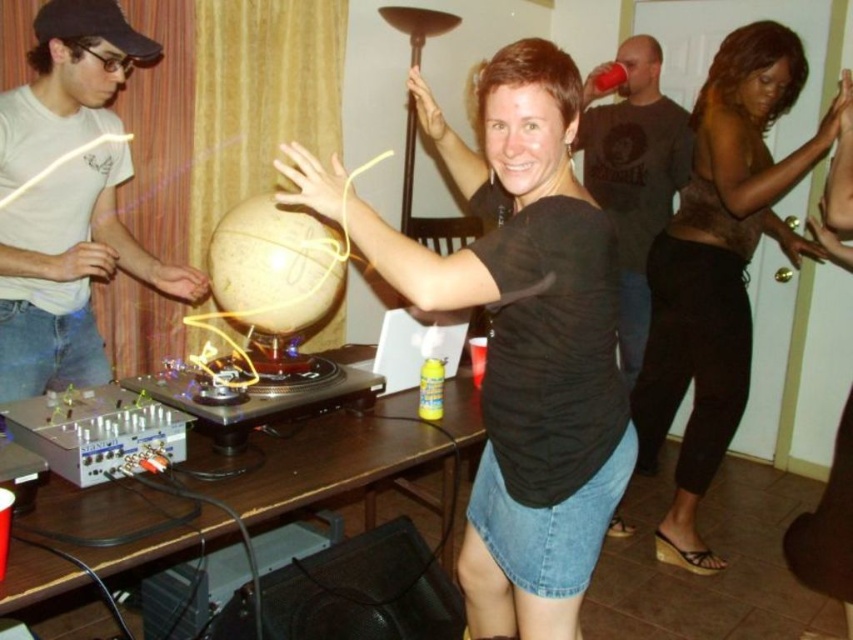
Question: Can you confirm if black matte shirt at center is positioned below matte white shirt at upper left?

Choices:
 (A) yes
 (B) no

Answer: (A)

Question: Does matte white shirt at upper left come behind dark gray t-shirt at upper right?

Choices:
 (A) yes
 (B) no

Answer: (B)

Question: Which of these objects is positioned closest to the dark gray t-shirt at upper right?

Choices:
 (A) black matte shirt at center
 (B) brown wooden table at center
 (C) brown sheer top at upper right
 (D) matte white shirt at upper left

Answer: (C)

Question: Can you confirm if black matte shirt at center is bigger than dark gray t-shirt at upper right?

Choices:
 (A) yes
 (B) no

Answer: (A)

Question: Based on their relative distances, which object is nearer to the brown sheer top at upper right?

Choices:
 (A) dark gray t-shirt at upper right
 (B) matte white shirt at upper left
 (C) black matte shirt at center
 (D) brown wooden table at center

Answer: (A)

Question: Which of the following is the closest to the observer?

Choices:
 (A) (498, 362)
 (B) (625, 301)
 (C) (689, 352)

Answer: (A)